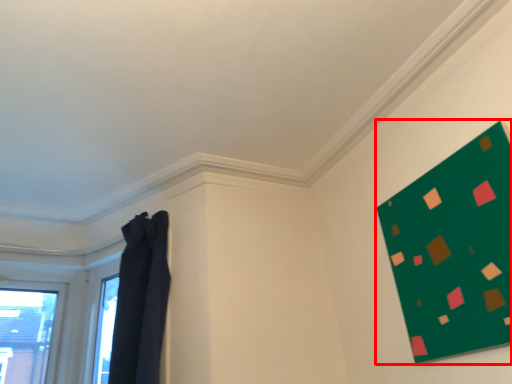
Question: Observing the image, what is the correct spatial positioning of bulletin board (annotated by the red box) in reference to curtain?

Choices:
 (A) left
 (B) right

Answer: (B)